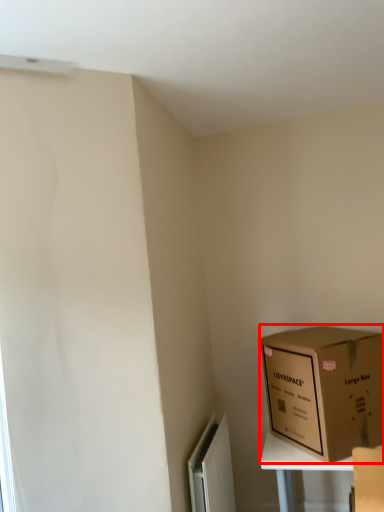
Question: From the image's perspective, where is box (annotated by the red box) located in relation to radiator in the image?

Choices:
 (A) above
 (B) below

Answer: (A)